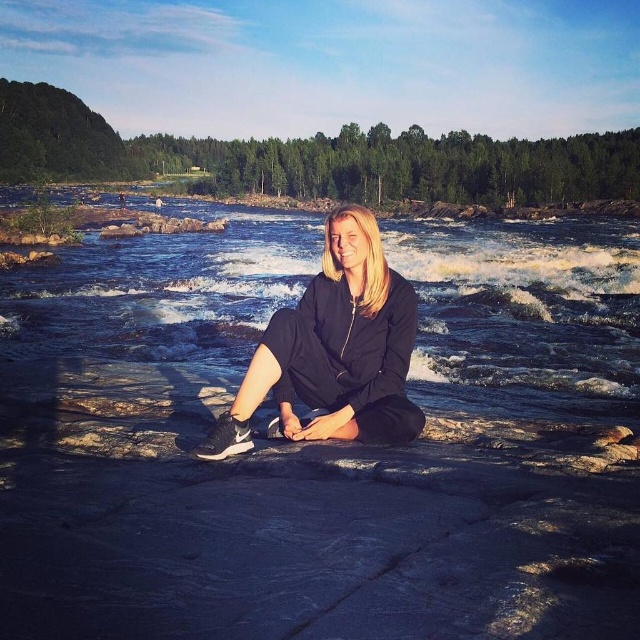
Question: Is smooth stone creek at center bigger than black matte tracksuit at center?

Choices:
 (A) yes
 (B) no

Answer: (A)

Question: Is smooth stone creek at center wider than black matte tracksuit at center?

Choices:
 (A) no
 (B) yes

Answer: (B)

Question: Among these points, which one is nearest to the camera?

Choices:
 (A) (328, 436)
 (B) (548, 616)

Answer: (B)

Question: Is smooth stone creek at center to the left of black matte tracksuit at center from the viewer's perspective?

Choices:
 (A) no
 (B) yes

Answer: (A)

Question: Which point is closer to the camera?

Choices:
 (A) (273, 324)
 (B) (93, 362)

Answer: (A)